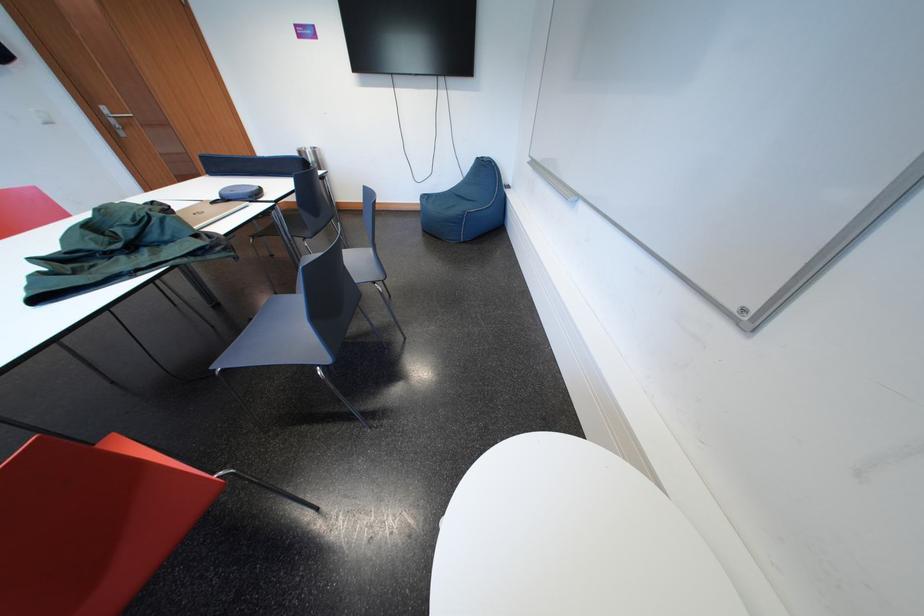
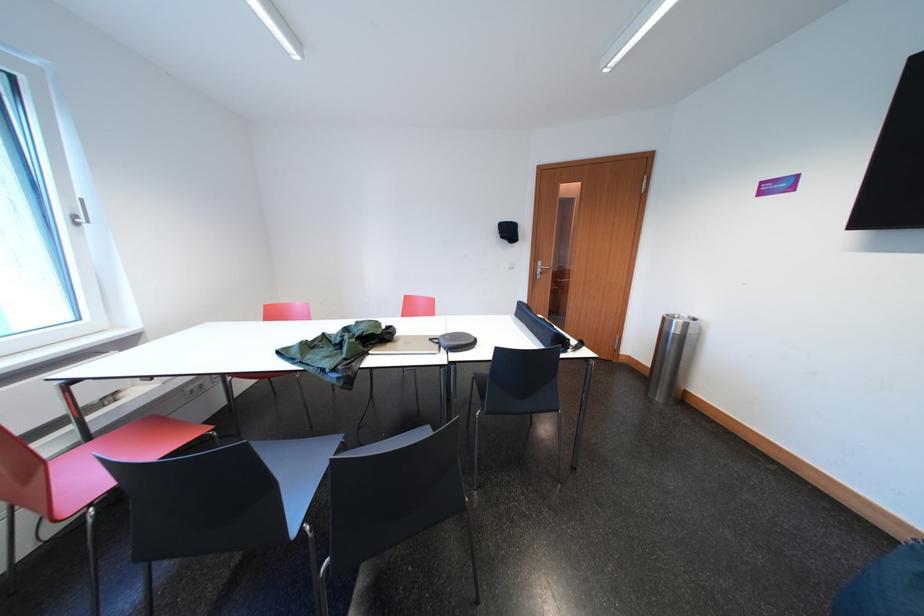
In the second image, find the point that corresponds to point (113, 113) in the first image.

(550, 268)